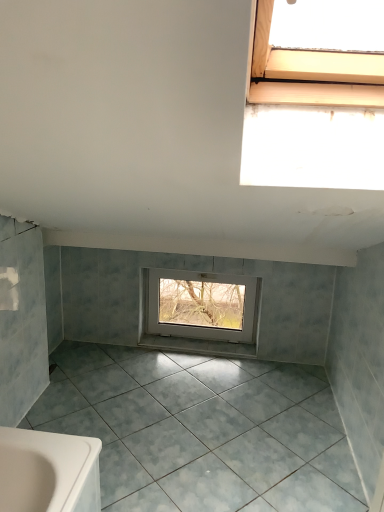
Locate an element on the screen. The image size is (384, 512). free space above white glossy tile at center (from a real-world perspective) is located at coordinates (203, 341).